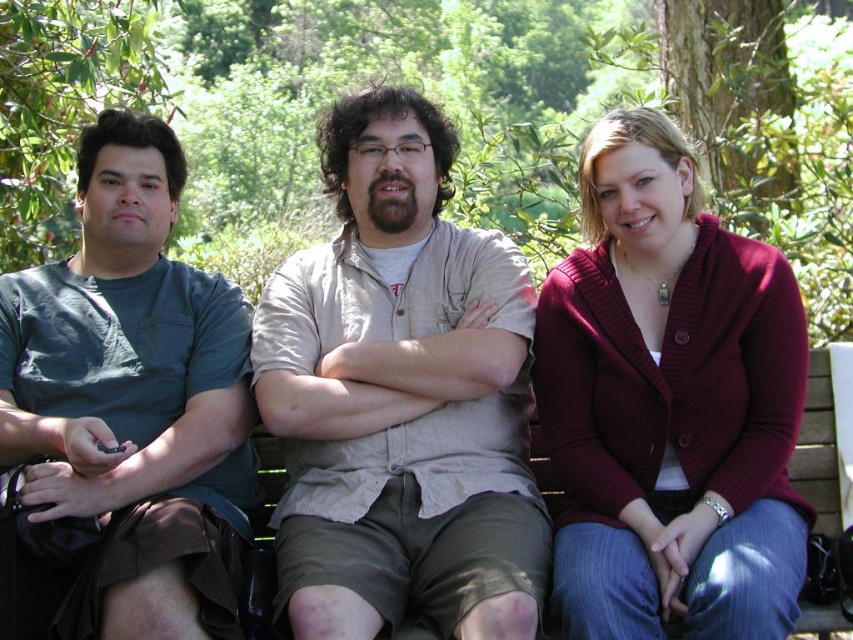
Question: Estimate the real-world distances between objects in this image. Which object is closer to the maroon knit cardigan at center?

Choices:
 (A) matte green t-shirt at left
 (B) beige cotton shirt at center

Answer: (B)

Question: Is beige cotton shirt at center positioned behind matte green t-shirt at left?

Choices:
 (A) yes
 (B) no

Answer: (A)

Question: Considering the relative positions of beige cotton shirt at center and maroon knit cardigan at center in the image provided, where is beige cotton shirt at center located with respect to maroon knit cardigan at center?

Choices:
 (A) left
 (B) right

Answer: (A)

Question: Is beige cotton shirt at center smaller than maroon knit cardigan at center?

Choices:
 (A) yes
 (B) no

Answer: (B)

Question: Which point is closer to the camera?

Choices:
 (A) (523, 356)
 (B) (624, 502)

Answer: (B)

Question: Estimate the real-world distances between objects in this image. Which object is closer to the matte green t-shirt at left?

Choices:
 (A) maroon knit cardigan at center
 (B) beige cotton shirt at center

Answer: (B)